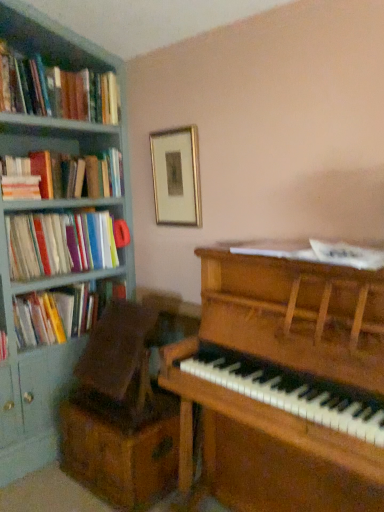
Question: Can you confirm if hardcover book at left, the first book positioned from the bottom, is bigger than hardcover books at left, acting as the third book starting from the bottom?

Choices:
 (A) yes
 (B) no

Answer: (A)

Question: Is hardcover book at left, the fourth book when ordered from top to bottom, thinner than hardcover books at left, acting as the third book starting from the bottom?

Choices:
 (A) yes
 (B) no

Answer: (B)

Question: Is hardcover book at left, the fourth book when ordered from top to bottom, closer to the viewer compared to hardcover books at left, acting as the third book starting from the bottom?

Choices:
 (A) yes
 (B) no

Answer: (B)

Question: Is the position of hardcover book at left, the fourth book when ordered from top to bottom, more distant than that of hardcover books at left, acting as the third book starting from the bottom?

Choices:
 (A) yes
 (B) no

Answer: (A)

Question: Does hardcover book at left, the fourth book when ordered from top to bottom, have a greater height compared to hardcover books at left, the second book positioned from the top?

Choices:
 (A) no
 (B) yes

Answer: (B)

Question: Relative to hardcover book at left, the fourth book when ordered from top to bottom, is gold-framed picture at upper center in front or behind?

Choices:
 (A) behind
 (B) front

Answer: (A)

Question: From a real-world perspective, is gold-framed picture at upper center above or below hardcover book at left, the fourth book when ordered from top to bottom?

Choices:
 (A) below
 (B) above

Answer: (B)

Question: From the image's perspective, is gold-framed picture at upper center above or below hardcover book at left, the first book positioned from the bottom?

Choices:
 (A) below
 (B) above

Answer: (B)

Question: In terms of width, does gold-framed picture at upper center look wider or thinner when compared to hardcover book at left, the first book positioned from the bottom?

Choices:
 (A) wide
 (B) thin

Answer: (B)

Question: Based on their positions, is hardcover books at left, marked as the 2th book in a bottom-to-top arrangement, located to the left or right of hardcover book at left, the first book positioned from the bottom?

Choices:
 (A) right
 (B) left

Answer: (B)

Question: From a real-world perspective, is hardcover books at left, marked as the 2th book in a bottom-to-top arrangement, positioned above or below hardcover book at left, the first book positioned from the bottom?

Choices:
 (A) below
 (B) above

Answer: (B)

Question: From the image's perspective, is hardcover books at left, the 3th book in the top-to-bottom sequence, above or below hardcover book at left, the first book positioned from the bottom?

Choices:
 (A) below
 (B) above

Answer: (B)

Question: Is hardcover books at left, marked as the 2th book in a bottom-to-top arrangement, inside or outside of hardcover book at left, the fourth book when ordered from top to bottom?

Choices:
 (A) inside
 (B) outside

Answer: (B)

Question: From the image's perspective, is wooden drawer at lower left positioned above or below hardcover book at left, the fourth book when ordered from top to bottom?

Choices:
 (A) above
 (B) below

Answer: (B)

Question: Is wooden drawer at lower left to the left or to the right of hardcover book at left, the first book positioned from the bottom, in the image?

Choices:
 (A) right
 (B) left

Answer: (A)